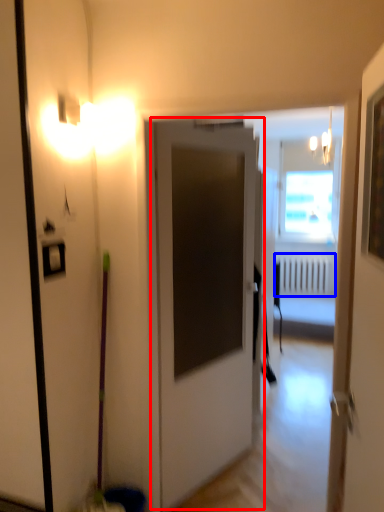
Question: Which object is further to the camera taking this photo, door (highlighted by a red box) or radiator (highlighted by a blue box)?

Choices:
 (A) door
 (B) radiator

Answer: (B)